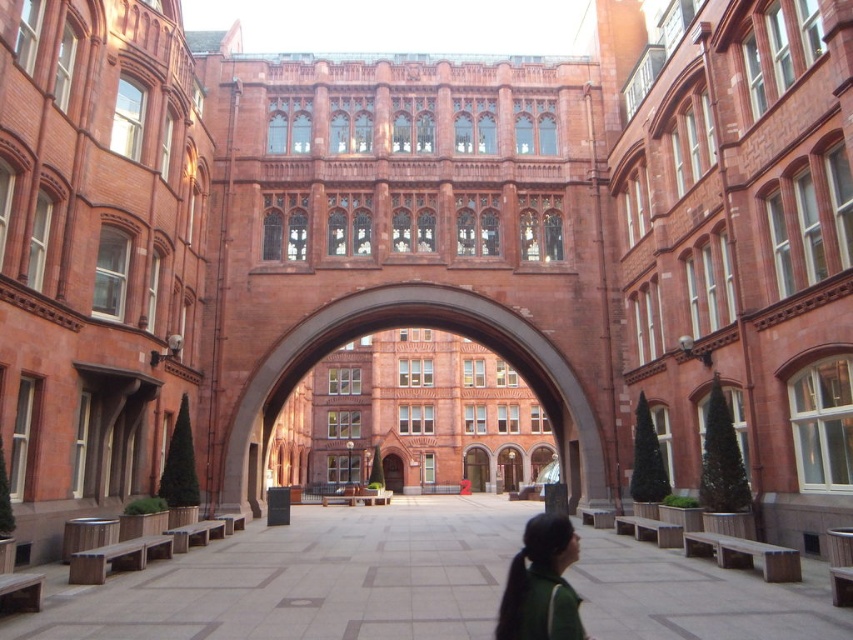
You are a visitor standing at the entrance of the courtyard. You see the red brick archway at center and the green fabric at lower center. Which object is closer to you?

The red brick archway at center is closer to you than the green fabric at lower center because the green fabric at lower center is behind the red brick archway at center.

You are standing in the courtyard and want to take a photo of the archway. The camera you are using has a maximum focus range of 75 meters. Will the point at coordinates point (x=410, y=314) be in focus if you focus on the archway?

The point at coordinates point (x=410, y=314) is 76.34 meters from the camera, which exceeds the camera maximum focus range of 75 meters. Therefore, the point will not be in focus.

You are an architect visiting the courtyard and need to place a decorative sculpture. The sculpture requires a base that must be smaller than the red brick archway at center. Can you use the green fabric at lower center as the base? Explain your reasoning.

The red brick archway at center has a larger size compared to green fabric at lower center. Since the green fabric at lower center is smaller than the archway, it can be used as the base for the sculpture as long as its dimensions meet the required specifications for the sculpture.